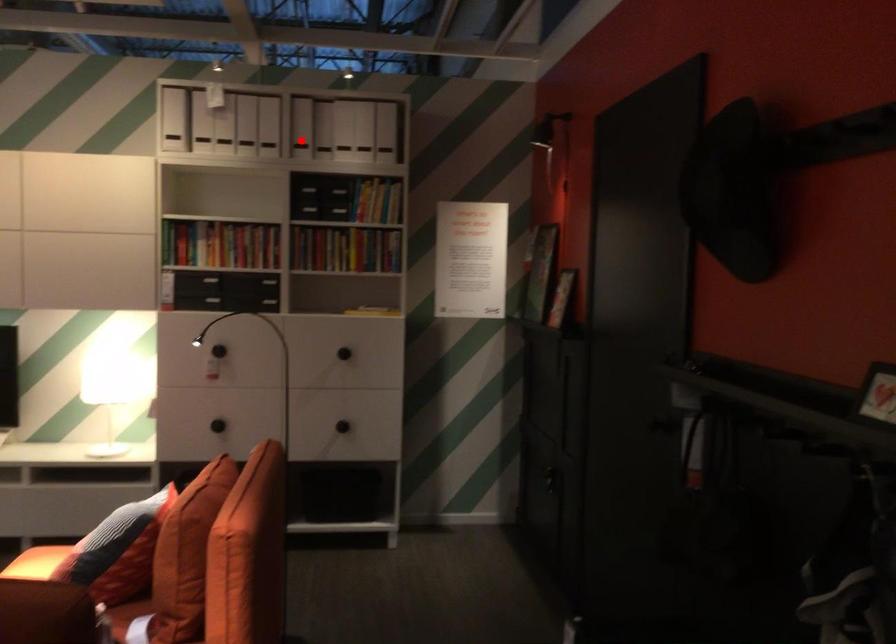
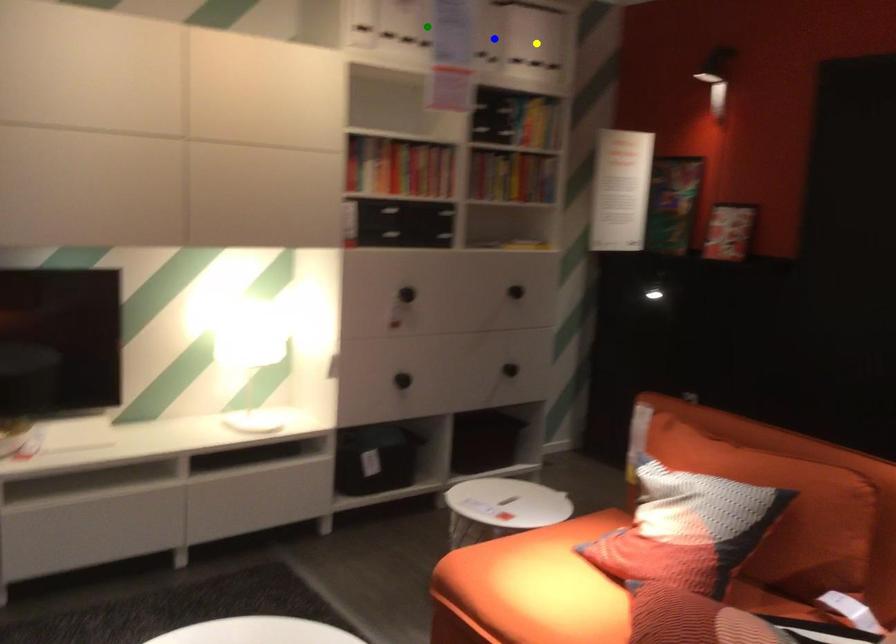
Question: I am providing you with two images of the same scene from different viewpoints. A red point is marked on the first image. You are given multiple points on the second image. In image 2, which mark is for the same physical point as the one in image 1?

Choices:
 (A) yellow point
 (B) blue point
 (C) green point

Answer: (B)